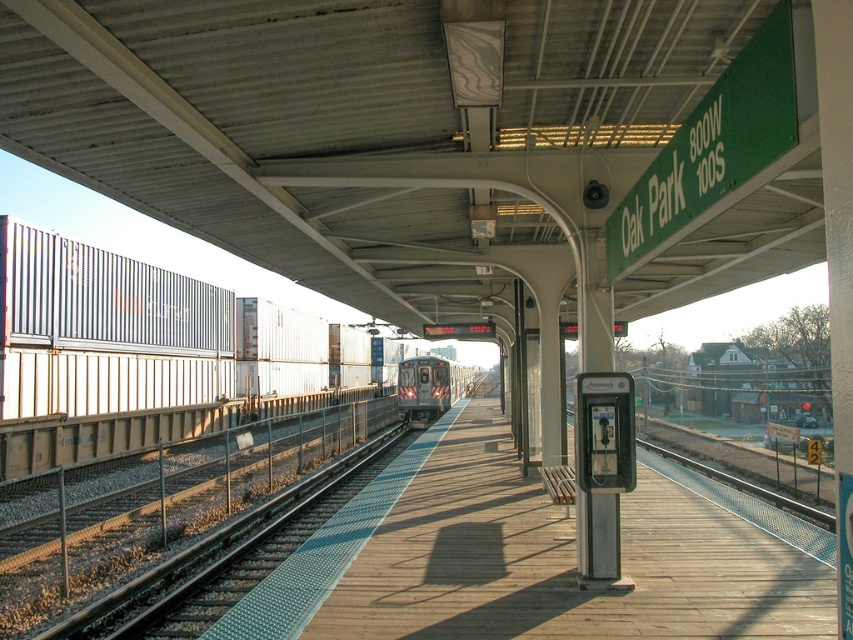
You are a maintenance worker needing to walk across the wooden platform at center to inspect the silver metallic train at center. Is the platform wide enough to allow you to walk alongside the train without stepping onto the tracks?

The wooden platform at center is wider than the silver metallic train at center, so yes, the platform is wide enough to allow walking alongside the train without stepping onto the tracks.

You are a maintenance worker on the wooden platform at center. You need to reach the top of the silver metallic train at center to inspect its roof. Given that the platform is lower than the train, what challenge might you face?

The wooden platform at center has a lesser height compared to the silver metallic train at center, so reaching the top of the silver metallic train at center from the wooden platform at center would be difficult due to the height difference.